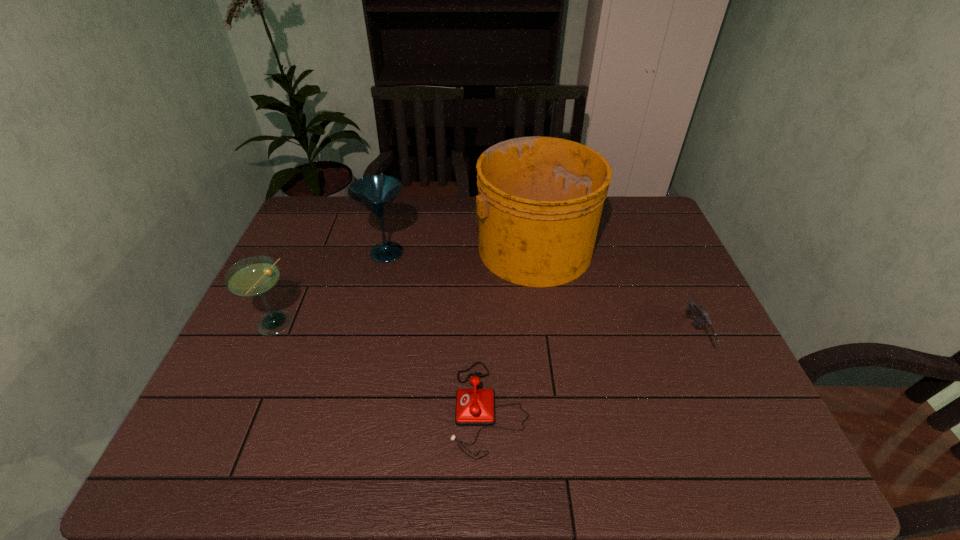
The width and height of the screenshot is (960, 540). In the image, there is a desktop. What are the coordinates of `vacant space at the far edge` in the screenshot? It's located at (418, 209).

The image size is (960, 540). I want to click on free location at the near edge, so click(x=586, y=459).

Image resolution: width=960 pixels, height=540 pixels. In order to click on free space at the left edge of the desktop in this screenshot , I will do `click(300, 260)`.

This screenshot has width=960, height=540. I want to click on free region at the right edge of the desktop, so click(650, 287).

Find the location of `vacant space at the far left corner of the desktop`. vacant space at the far left corner of the desktop is located at coordinates (348, 204).

Locate an element on the screen. Image resolution: width=960 pixels, height=540 pixels. unoccupied position between the nearest object and the second shortest object is located at coordinates (592, 372).

I want to click on blank region between the right martini and the shortest object, so point(439,330).

I want to click on blank region between the nearest object and the bucket, so click(511, 327).

The width and height of the screenshot is (960, 540). In order to click on vacant area that lies between the bucket and the right martini in this screenshot , I will do 460,249.

Locate an element on the screen. The height and width of the screenshot is (540, 960). vacant region between the tallest object and the shortest object is located at coordinates (511, 327).